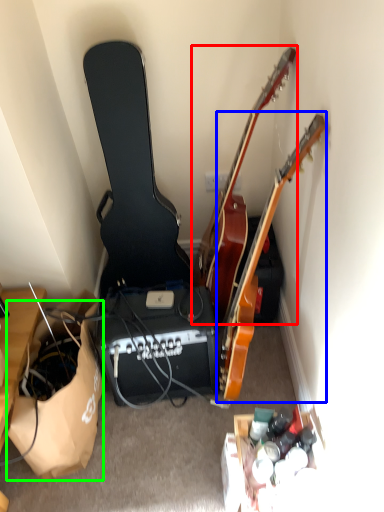
Question: Based on their relative distances, which object is nearer to guitar (highlighted by a red box)? Choose from guitar (highlighted by a blue box) and paper bag (highlighted by a green box).

Choices:
 (A) guitar
 (B) paper bag

Answer: (A)